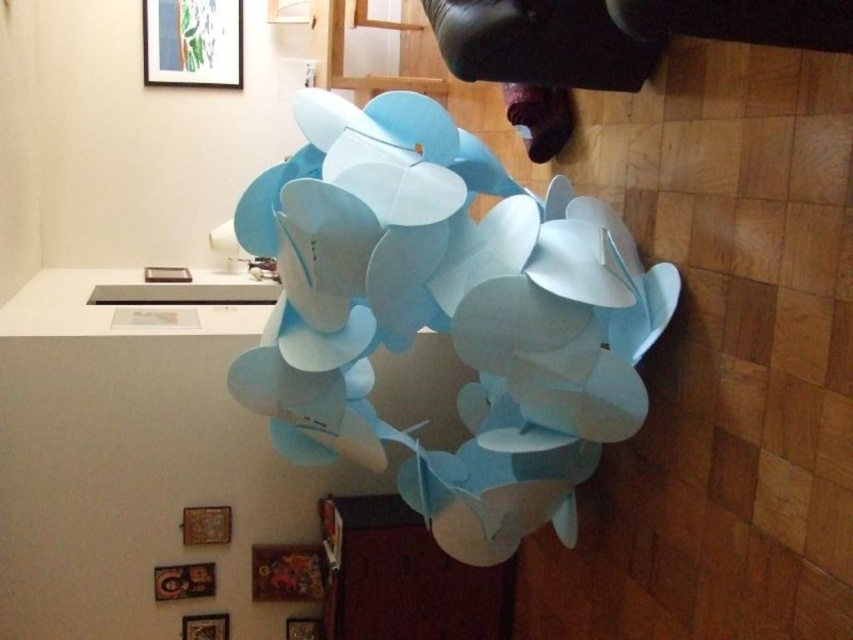
Question: Does light blue paper at center appear over matte white frame at upper center?

Choices:
 (A) yes
 (B) no

Answer: (B)

Question: Which point is closer to the camera?

Choices:
 (A) (171, 275)
 (B) (625, 243)

Answer: (B)

Question: Does light blue paper at center appear on the right side of matte white frame at upper center?

Choices:
 (A) yes
 (B) no

Answer: (A)

Question: Is light blue paper at center behind matte white frame at upper center?

Choices:
 (A) yes
 (B) no

Answer: (B)

Question: Among these points, which one is nearest to the camera?

Choices:
 (A) pos(503,333)
 (B) pos(183,275)

Answer: (A)